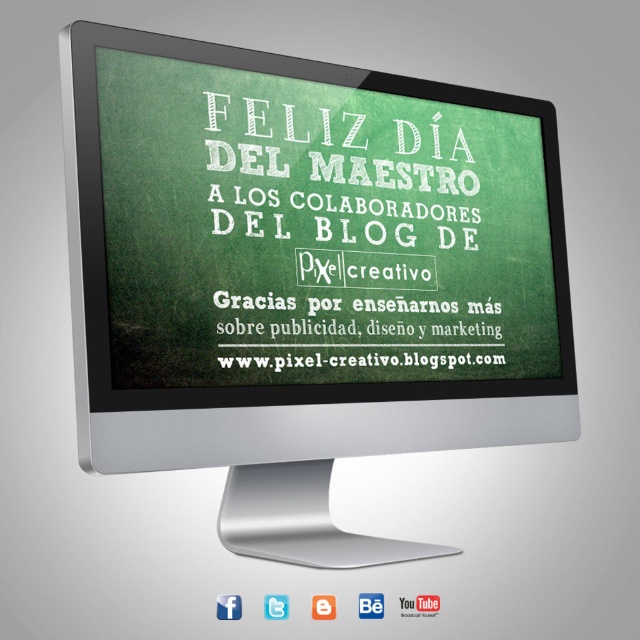
Question: Can you confirm if silver metallic computer monitor at center is wider than white chalkboard at center?

Choices:
 (A) no
 (B) yes

Answer: (B)

Question: In this image, where is silver metallic computer monitor at center located relative to white chalkboard at center?

Choices:
 (A) right
 (B) left

Answer: (B)

Question: Among these points, which one is nearest to the camera?

Choices:
 (A) (278, 467)
 (B) (337, 148)

Answer: (A)

Question: Which of the following is the farthest from the observer?

Choices:
 (A) silver metallic computer monitor at center
 (B) white chalkboard at center

Answer: (B)

Question: Does silver metallic computer monitor at center appear under white chalkboard at center?

Choices:
 (A) no
 (B) yes

Answer: (B)